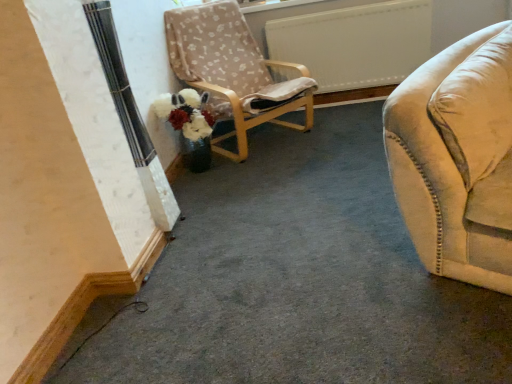
Question: Is white fluffy flower at center bigger than beige fabric chair at center?

Choices:
 (A) yes
 (B) no

Answer: (B)

Question: From the image's perspective, is white fluffy flower at center beneath beige fabric chair at center?

Choices:
 (A) yes
 (B) no

Answer: (A)

Question: From the image's perspective, is white fluffy flower at center located above beige fabric chair at center?

Choices:
 (A) yes
 (B) no

Answer: (B)

Question: Are white fluffy flower at center and beige fabric chair at center beside each other?

Choices:
 (A) no
 (B) yes

Answer: (A)

Question: Could you tell me if white fluffy flower at center is turned towards beige fabric chair at center?

Choices:
 (A) yes
 (B) no

Answer: (A)

Question: Is white fluffy flower at center thinner than beige fabric chair at center?

Choices:
 (A) no
 (B) yes

Answer: (B)

Question: Considering the relative sizes of beige fabric chair at center and white fluffy flower at center in the image provided, is beige fabric chair at center shorter than white fluffy flower at center?

Choices:
 (A) yes
 (B) no

Answer: (B)

Question: Is beige fabric chair at center wider than white fluffy flower at center?

Choices:
 (A) no
 (B) yes

Answer: (B)

Question: Does beige fabric chair at center lie behind white fluffy flower at center?

Choices:
 (A) yes
 (B) no

Answer: (B)

Question: Is beige fabric chair at center not within white fluffy flower at center?

Choices:
 (A) no
 (B) yes

Answer: (B)

Question: Is beige fabric chair at center smaller than white fluffy flower at center?

Choices:
 (A) no
 (B) yes

Answer: (A)

Question: Is beige fabric chair at center far from white fluffy flower at center?

Choices:
 (A) yes
 (B) no

Answer: (B)

Question: From the image's perspective, is beige fabric chair at center above or below white fluffy flower at center?

Choices:
 (A) below
 (B) above

Answer: (B)